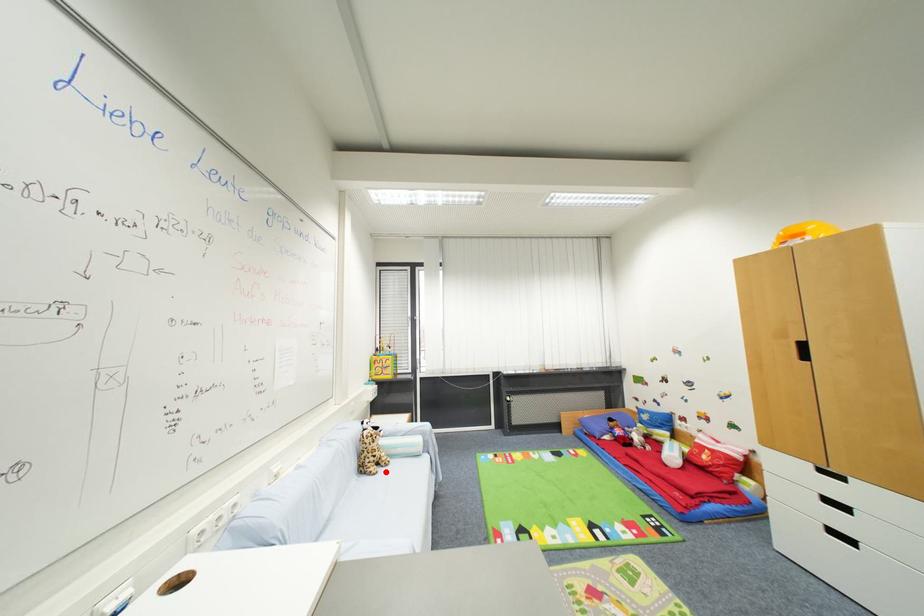
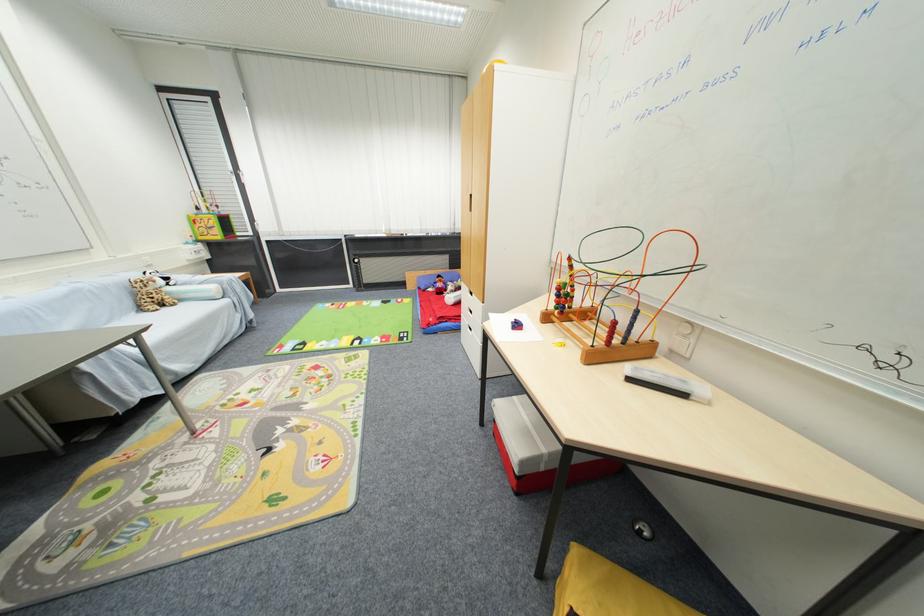
Question: I am providing you with two images of the same scene from different viewpoints. Given a red point in image1, look at the same physical point in image2. Is it:

Choices:
 (A) Closer to the viewpoint
 (B) Farther from the viewpoint

Answer: (A)